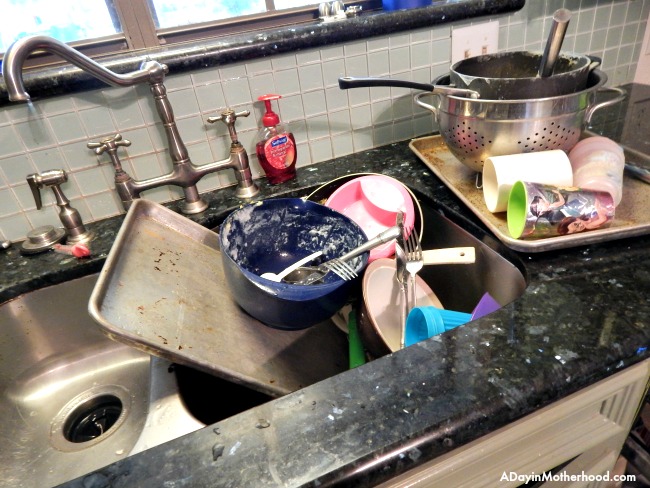
This screenshot has height=488, width=650. I want to click on faucet, so click(88, 61).